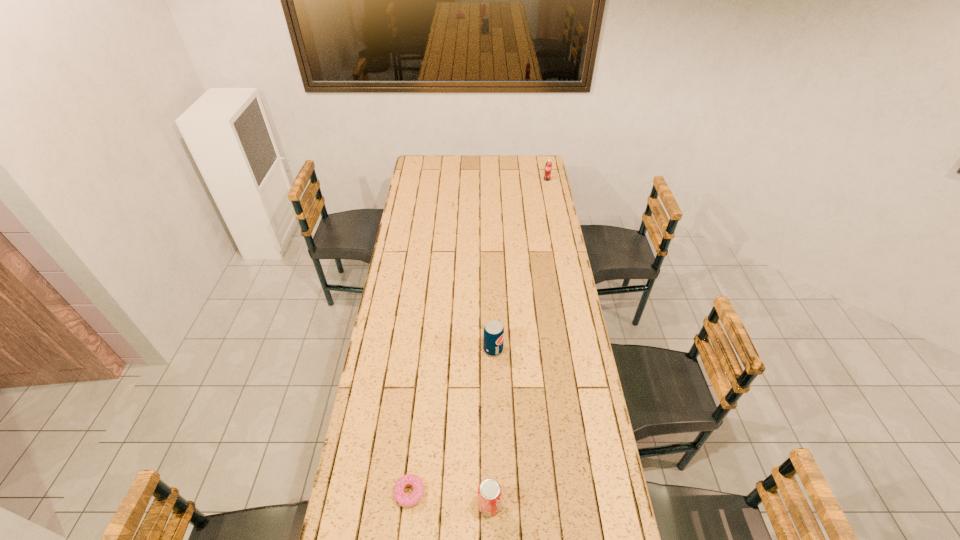
This screenshot has height=540, width=960. I want to click on soda can that is the second closest to the rightmost object, so click(x=489, y=491).